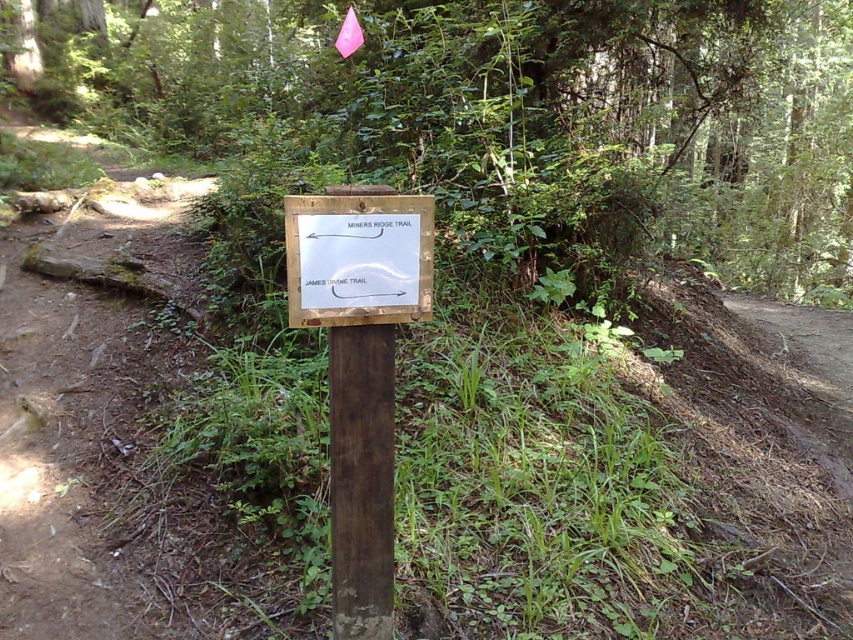
Is dark brown wood at center to the right of white paper sign at center from the viewer's perspective?

No, dark brown wood at center is not to the right of white paper sign at center.

Who is more forward, (392, 602) or (395, 243)?

Point (395, 243)

Identify the location of dark brown wood at center. (361, 480).

Consider the image. Is brown wooden signpost at center above dark brown wood at center?

Yes.

Between point (589, 0) and point (381, 349), which one is positioned behind?

Point (589, 0)

Identify the location of brown wooden signpost at center. (514, 109).

Is point (640, 58) positioned before point (399, 268)?

No, it is behind (399, 268).

Where is `brown wooden signpost at center`? The image size is (853, 640). brown wooden signpost at center is located at coordinates (514, 109).